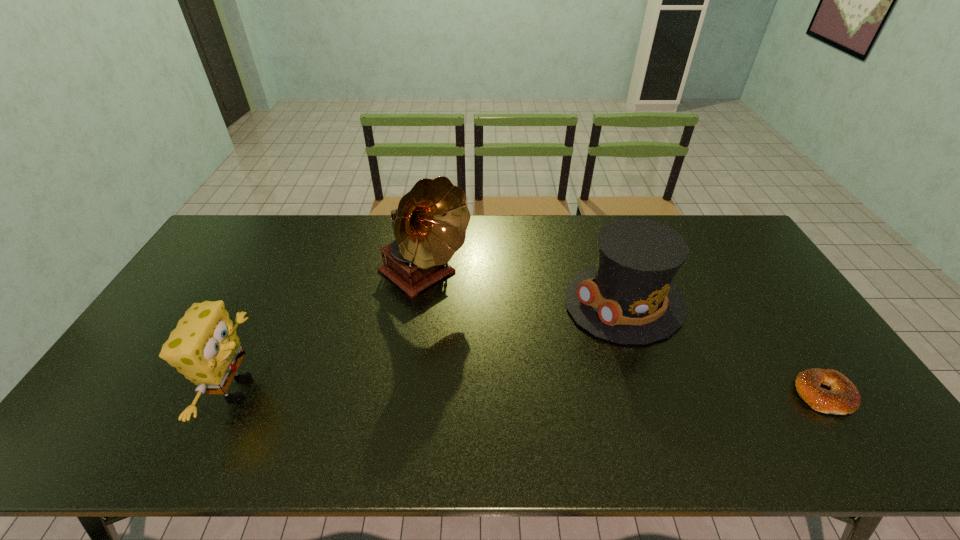
Find the location of a particular element. vacant space that's between the sponge and the shortest object is located at coordinates (531, 392).

Where is `vacant point located between the third object from left to right and the shortest object`? vacant point located between the third object from left to right and the shortest object is located at coordinates (725, 348).

Locate an element on the screen. free space between the third object from left to right and the sponge is located at coordinates (431, 346).

Select which object is the second closest to the leftmost object. Please provide its 2D coordinates. Your answer should be formatted as a tuple, i.e. [(x, y)], where the tuple contains the x and y coordinates of a point satisfying the conditions above.

[(629, 298)]

Find the location of a particular element. Image resolution: width=960 pixels, height=540 pixels. object that is the third closest to the third object from right to left is located at coordinates (843, 398).

Identify the location of free space that satisfies the following two spatial constraints: 1. on the front side of the dress hat; 2. on the left side of the shortest object. (657, 395).

Locate an element on the screen. Image resolution: width=960 pixels, height=540 pixels. vacant space that satisfies the following two spatial constraints: 1. on the front side of the tallest object; 2. on the left side of the dress hat is located at coordinates pyautogui.click(x=420, y=302).